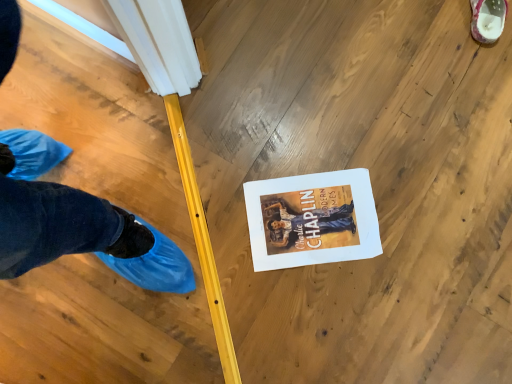
In order to face white paper at center, should I rotate leftwards or rightwards?

You should rotate right by 7.683 degrees.

In order to click on white paper at center in this screenshot , I will do `click(312, 219)`.

The height and width of the screenshot is (384, 512). Describe the element at coordinates (312, 219) in the screenshot. I see `white paper at center` at that location.

Measure the distance between white textured shoe at upper right and camera.

white textured shoe at upper right and camera are 3.33 feet apart from each other.

The width and height of the screenshot is (512, 384). Describe the element at coordinates (487, 20) in the screenshot. I see `white textured shoe at upper right` at that location.

I want to click on white textured shoe at upper right, so click(x=487, y=20).

You are a GUI agent. You are given a task and a screenshot of the screen. Output one action in this format:
    pyautogui.click(x=<x>, y=<y>)
    Task: Click on the white paper at center
    
    Given the screenshot: What is the action you would take?
    pyautogui.click(x=312, y=219)

Which object is positioned more to the left, white paper at center or white textured shoe at upper right?

From the viewer's perspective, white paper at center appears more on the left side.

Is white paper at center further to the viewer compared to white textured shoe at upper right?

No.

Which is nearer, (314, 237) or (488, 5)?

Clearly, point (314, 237) is closer to the camera than point (488, 5).

From the image's perspective, is white paper at center located above or below white textured shoe at upper right?

Clearly, from the image's perspective, white paper at center is below white textured shoe at upper right.

From a real-world perspective, is white paper at center above or below white textured shoe at upper right?

Clearly, from a real-world perspective, white paper at center is below white textured shoe at upper right.

Between white paper at center and white textured shoe at upper right, which one has larger width?

white paper at center is wider.

Based on the photo, considering the sizes of objects white paper at center and white textured shoe at upper right in the image provided, who is taller, white paper at center or white textured shoe at upper right?

white textured shoe at upper right.

Can you confirm if white paper at center is smaller than white textured shoe at upper right?

Yes.

Is white paper at center positioned beyond the bounds of white textured shoe at upper right?

Yes, white paper at center is not within white textured shoe at upper right.

Would you say white paper at center is a long distance from white textured shoe at upper right?

No, white paper at center is in close proximity to white textured shoe at upper right.

Consider the image. Is white paper at center facing away from white textured shoe at upper right?

white paper at center is not turned away from white textured shoe at upper right.

The image size is (512, 384). I want to click on footwear that appears on the right of white paper at center, so click(x=487, y=20).

Which is more to the left, white textured shoe at upper right or white paper at center?

white paper at center is more to the left.

Which is behind, white textured shoe at upper right or white paper at center?

white textured shoe at upper right is further away from the camera.

Which point is more forward, (504, 7) or (324, 256)?

The point (324, 256) is more forward.

From the image's perspective, is white textured shoe at upper right on white paper at center?

Yes, from the image's perspective, white textured shoe at upper right is over white paper at center.

From a real-world perspective, is white textured shoe at upper right on top of white paper at center?

Indeed, from a real-world perspective, white textured shoe at upper right stands above white paper at center.

Considering the sizes of objects white textured shoe at upper right and white paper at center in the image provided, who is wider, white textured shoe at upper right or white paper at center?

With larger width is white paper at center.

Between white textured shoe at upper right and white paper at center, which one has less height?

white paper at center.

Can you confirm if white textured shoe at upper right is bigger than white paper at center?

Indeed, white textured shoe at upper right has a larger size compared to white paper at center.

Is white textured shoe at upper right inside or outside of white paper at center?

white textured shoe at upper right is spatially situated outside white paper at center.

Does white textured shoe at upper right touch white paper at center?

No, white textured shoe at upper right is not making contact with white paper at center.

Is white paper at center at the back of white textured shoe at upper right?

No, white textured shoe at upper right is not facing away from white paper at center.

The width and height of the screenshot is (512, 384). I want to click on magazine in front of the white textured shoe at upper right, so click(312, 219).

At what (x,y) coordinates should I click in order to perform the action: click on footwear that appears behind the white paper at center. Please return your answer as a coordinate pair (x, y). The height and width of the screenshot is (384, 512). Looking at the image, I should click on (487, 20).

Identify the location of magazine on the left of white textured shoe at upper right. (312, 219).